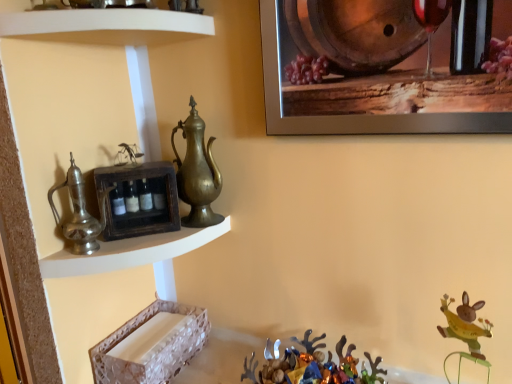
Question: From the image's perspective, is white glossy shelf at upper left, which is the first shelf from top to bottom, on top of white textured tray at lower left, the 1th shelf positioned from the bottom?

Choices:
 (A) yes
 (B) no

Answer: (A)

Question: Is white glossy shelf at upper left, which is the first shelf from top to bottom, aimed at white textured tray at lower left, the 1th shelf positioned from the bottom?

Choices:
 (A) yes
 (B) no

Answer: (B)

Question: Does white glossy shelf at upper left, which is the first shelf from top to bottom, have a lesser width compared to white textured tray at lower left, the 1th shelf positioned from the bottom?

Choices:
 (A) no
 (B) yes

Answer: (A)

Question: Are white glossy shelf at upper left, which is the first shelf from top to bottom, and white textured tray at lower left, the 1th shelf positioned from the bottom, located far from each other?

Choices:
 (A) no
 (B) yes

Answer: (A)

Question: From a real-world perspective, is white glossy shelf at upper left, which is the first shelf from top to bottom, physically above white textured tray at lower left, the fourth shelf when ordered from top to bottom?

Choices:
 (A) no
 (B) yes

Answer: (B)

Question: Is metallic silver reindeer at lower center bigger or smaller than wooden crate at upper left, placed as the 2th shelf when sorted from top to bottom?

Choices:
 (A) small
 (B) big

Answer: (B)

Question: Is metallic silver reindeer at lower center to the left or to the right of wooden crate at upper left, placed as the 2th shelf when sorted from top to bottom, in the image?

Choices:
 (A) right
 (B) left

Answer: (A)

Question: Considering their positions, is metallic silver reindeer at lower center located in front of or behind wooden crate at upper left, placed as the 2th shelf when sorted from top to bottom?

Choices:
 (A) front
 (B) behind

Answer: (A)

Question: From the image's perspective, is metallic silver reindeer at lower center above or below wooden crate at upper left, placed as the 2th shelf when sorted from top to bottom?

Choices:
 (A) below
 (B) above

Answer: (A)

Question: From a real-world perspective, relative to white glossy shelf at upper left, which is the first shelf from top to bottom, is brass/bronze jug at center, acting as the first jug starting from the right, vertically above or below?

Choices:
 (A) above
 (B) below

Answer: (B)

Question: Is point (193, 145) positioned closer to the camera than point (34, 21)?

Choices:
 (A) farther
 (B) closer

Answer: (A)

Question: Considering the relative positions of brass/bronze jug at center, the 2th jug positioned from the left, and white glossy shelf at upper left, marked as the 4th shelf in a bottom-to-top arrangement, in the image provided, is brass/bronze jug at center, the 2th jug positioned from the left, to the left or to the right of white glossy shelf at upper left, marked as the 4th shelf in a bottom-to-top arrangement,?

Choices:
 (A) right
 (B) left

Answer: (A)

Question: Looking at the image, does brass/bronze jug at center, placed as the first jug when sorted from back to front, seem bigger or smaller compared to white glossy shelf at upper left, which is the first shelf from top to bottom?

Choices:
 (A) big
 (B) small

Answer: (B)

Question: From the image's perspective, is wooden barrel at upper right positioned above or below wooden crate at upper left, placed as the 2th shelf when sorted from top to bottom?

Choices:
 (A) below
 (B) above

Answer: (B)

Question: In the image, is wooden barrel at upper right on the left side or the right side of wooden crate at upper left, which appears as the 3th shelf when ordered from the bottom?

Choices:
 (A) right
 (B) left

Answer: (A)